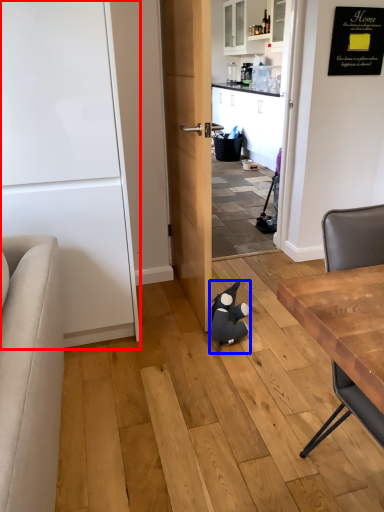
Question: Which object is further to the camera taking this photo, door (highlighted by a red box) or animal (highlighted by a blue box)?

Choices:
 (A) door
 (B) animal

Answer: (B)